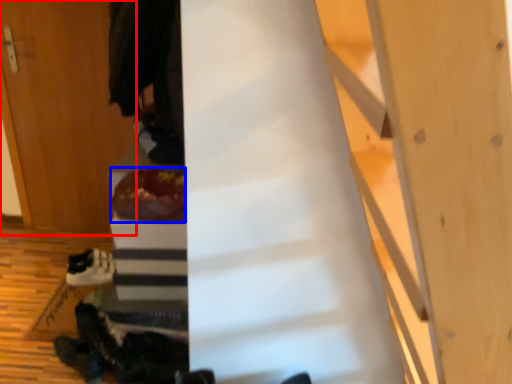
Question: Which object is closer to the camera taking this photo, door (highlighted by a red box) or food (highlighted by a blue box)?

Choices:
 (A) door
 (B) food

Answer: (B)